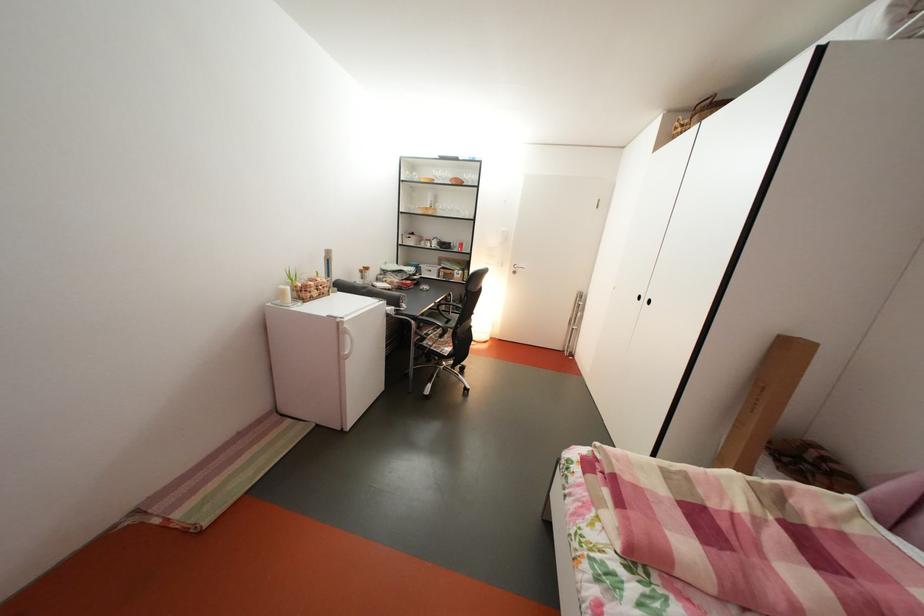
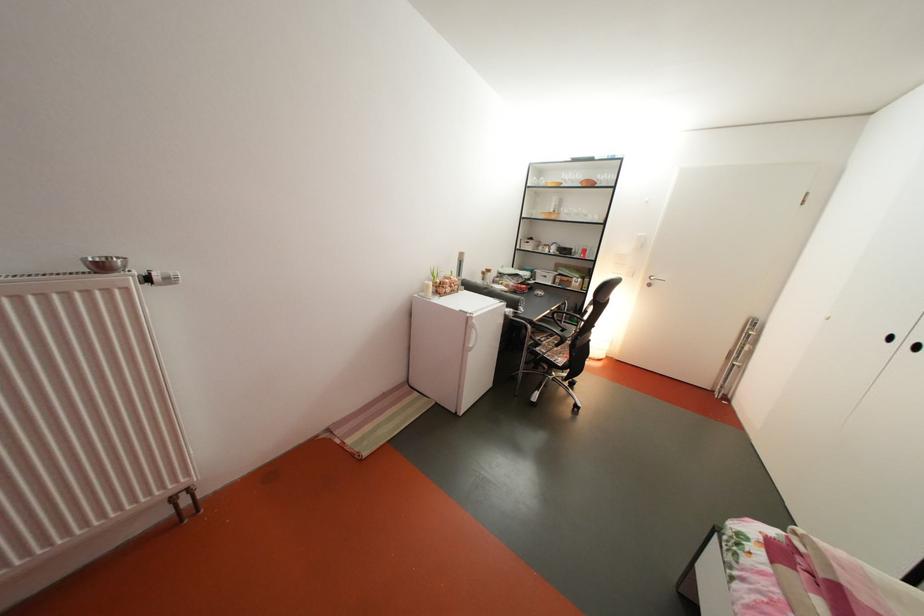
Locate, in the second image, the point that corresponds to the point at 436,339 in the first image.

(550, 344)